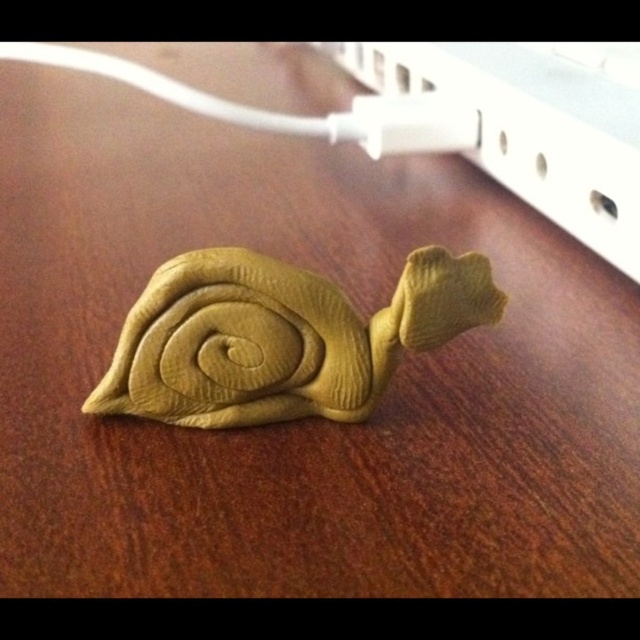
What do you see at coordinates (278, 337) in the screenshot? I see `matte yellow clay snail at center` at bounding box center [278, 337].

Does matte yellow clay snail at center have a lesser height compared to white plastic plug at upper center?

Yes.

Where is `matte yellow clay snail at center`? Image resolution: width=640 pixels, height=640 pixels. matte yellow clay snail at center is located at coordinates (278, 337).

The image size is (640, 640). In order to click on matte yellow clay snail at center in this screenshot , I will do `click(278, 337)`.